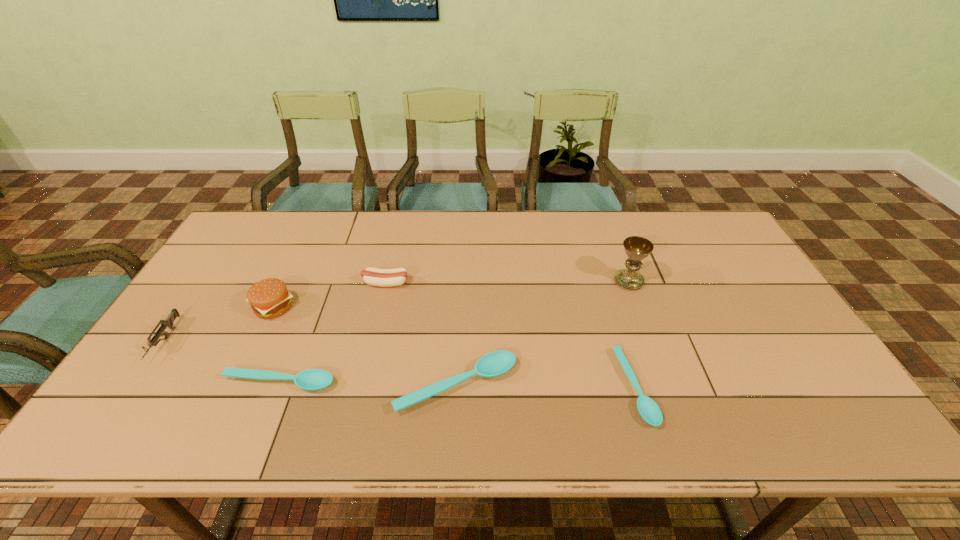
This screenshot has width=960, height=540. What are the coordinates of `the leftmost spoon` in the screenshot? It's located at (312, 379).

This screenshot has width=960, height=540. I want to click on the sixth tallest object, so click(312, 379).

Where is `the second spoon from left to right`? This screenshot has width=960, height=540. the second spoon from left to right is located at coordinates (494, 364).

Locate an element on the screen. The width and height of the screenshot is (960, 540). the sixth object from left to right is located at coordinates (650, 412).

The height and width of the screenshot is (540, 960). I want to click on the shortest object, so click(650, 412).

Where is `sausage`? sausage is located at coordinates (372, 276).

I want to click on chalice, so click(x=637, y=248).

Locate an element on the screen. The image size is (960, 540). the tallest object is located at coordinates (637, 248).

This screenshot has height=540, width=960. I want to click on the leftmost object, so [x=168, y=322].

Find the location of a particular element. The height and width of the screenshot is (540, 960). hamburger is located at coordinates (269, 298).